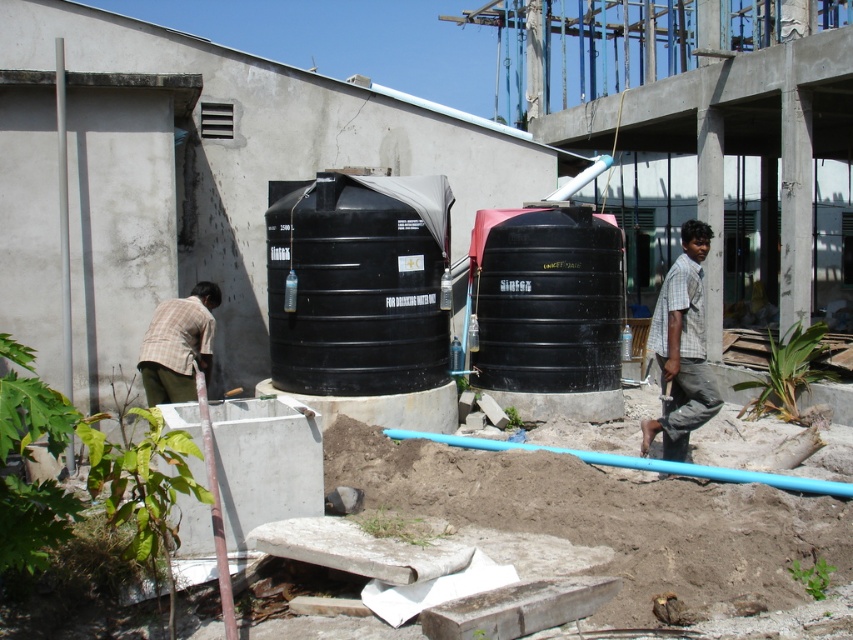
Question: Observing the image, what is the correct spatial positioning of black matte water tank at center in reference to plaid shirt at left?

Choices:
 (A) below
 (B) above

Answer: (B)

Question: Does gray checkered shirt at right have a lesser width compared to plaid shirt at left?

Choices:
 (A) yes
 (B) no

Answer: (A)

Question: Which point appears closest to the camera in this image?

Choices:
 (A) (316, 182)
 (B) (666, 440)
 (C) (550, 336)
 (D) (165, 320)

Answer: (B)

Question: Which of these objects is positioned closest to the plaid shirt at left?

Choices:
 (A) black matte tank at center
 (B) gray checkered shirt at right

Answer: (A)

Question: Which is farther from the black matte water tank at center?

Choices:
 (A) gray checkered shirt at right
 (B) plaid shirt at left
 (C) black matte tank at center

Answer: (A)

Question: Does gray checkered shirt at right appear on the left side of plaid shirt at left?

Choices:
 (A) no
 (B) yes

Answer: (A)